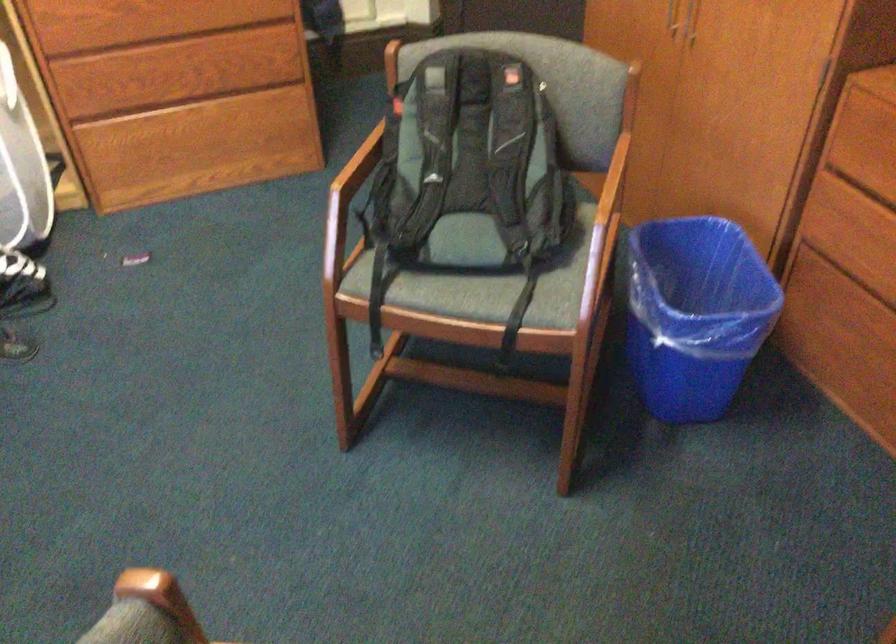
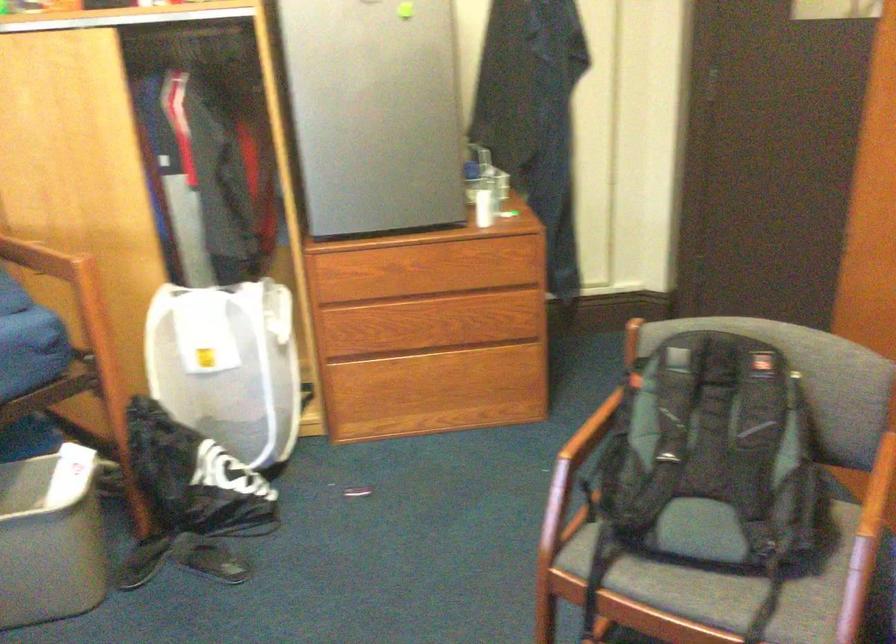
The point at (187, 154) is marked in the first image. Where is the corresponding point in the second image?

(419, 397)